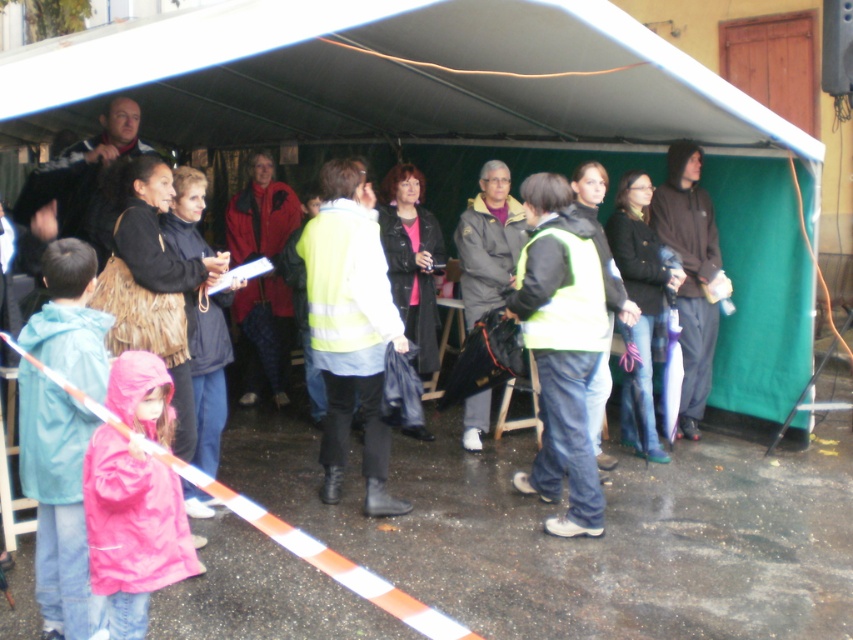
Does yellow reflective vest at center have a larger size compared to dark brown leather jacket at center?

Indeed, yellow reflective vest at center has a larger size compared to dark brown leather jacket at center.

Looking at this image, can you confirm if yellow reflective vest at center is positioned above dark brown leather jacket at center?

Incorrect, yellow reflective vest at center is not positioned above dark brown leather jacket at center.

At what (x,y) coordinates should I click in order to perform the action: click on yellow reflective vest at center. Please return your answer as a coordinate pair (x, y). This screenshot has height=640, width=853. Looking at the image, I should click on click(350, 326).

What are the coordinates of `yellow reflective vest at center` in the screenshot? It's located at (350, 326).

From the picture: Between high visibility yellow-green vest at center and matte gray jacket at center, which one is positioned lower?

high visibility yellow-green vest at center is lower down.

Who is more forward, (517, 289) or (508, 264)?

Point (517, 289)

Image resolution: width=853 pixels, height=640 pixels. Find the location of `high visibility yellow-green vest at center`. high visibility yellow-green vest at center is located at coordinates (560, 348).

Find the location of a particular element. high visibility yellow-green vest at center is located at coordinates (560, 348).

Does high visibility yellow-green vest at center lie in front of dark brown leather jacket at center?

Yes, it is in front of dark brown leather jacket at center.

Is point (567, 413) farther from viewer compared to point (624, 340)?

No, (567, 413) is in front of (624, 340).

This screenshot has height=640, width=853. Identify the location of high visibility yellow-green vest at center. (560, 348).